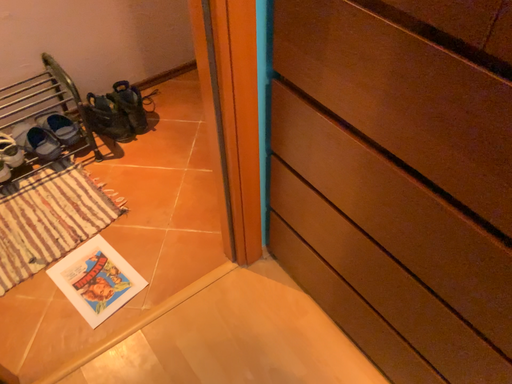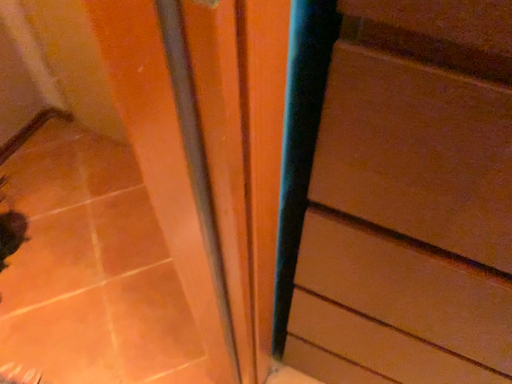
Question: How did the camera likely rotate when shooting the video?

Choices:
 (A) rotated right
 (B) rotated left

Answer: (A)